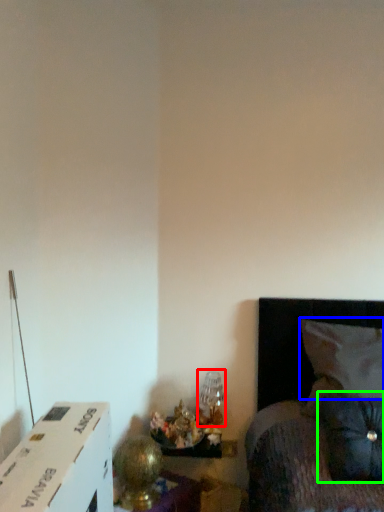
Question: Which is nearer to the table lamp (highlighted by a red box)? pillow (highlighted by a blue box) or pillow (highlighted by a green box).

Choices:
 (A) pillow
 (B) pillow

Answer: (A)